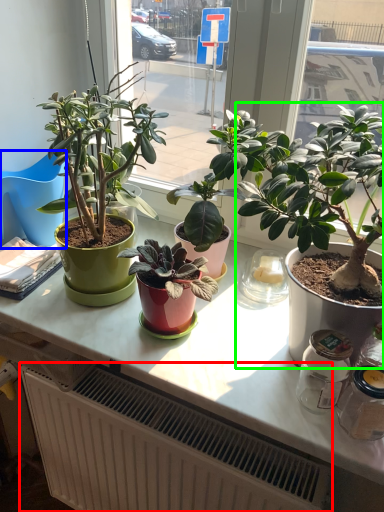
Question: Considering the real-world distances, which object is farthest from radiator (highlighted by a red box)? chair (highlighted by a blue box) or houseplant (highlighted by a green box)?

Choices:
 (A) chair
 (B) houseplant

Answer: (A)